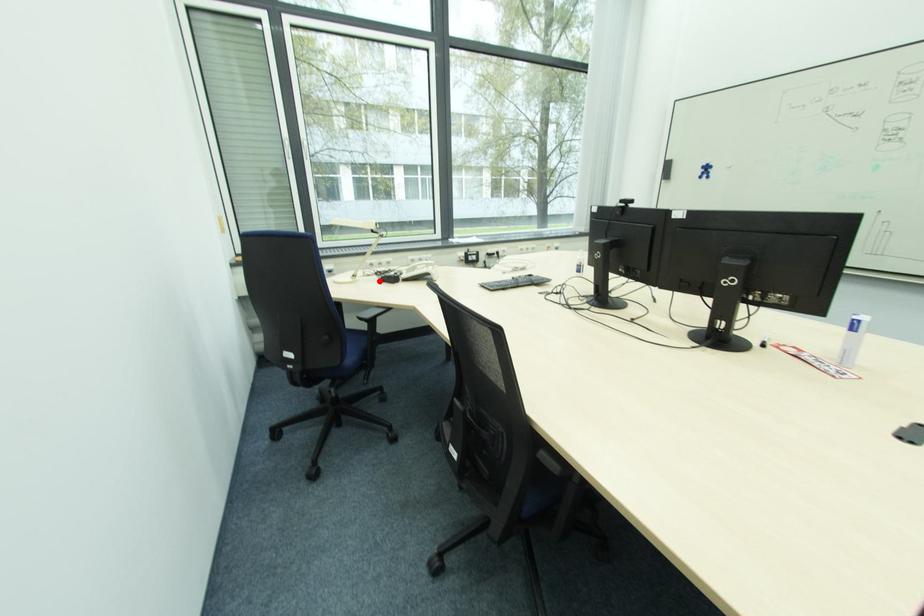
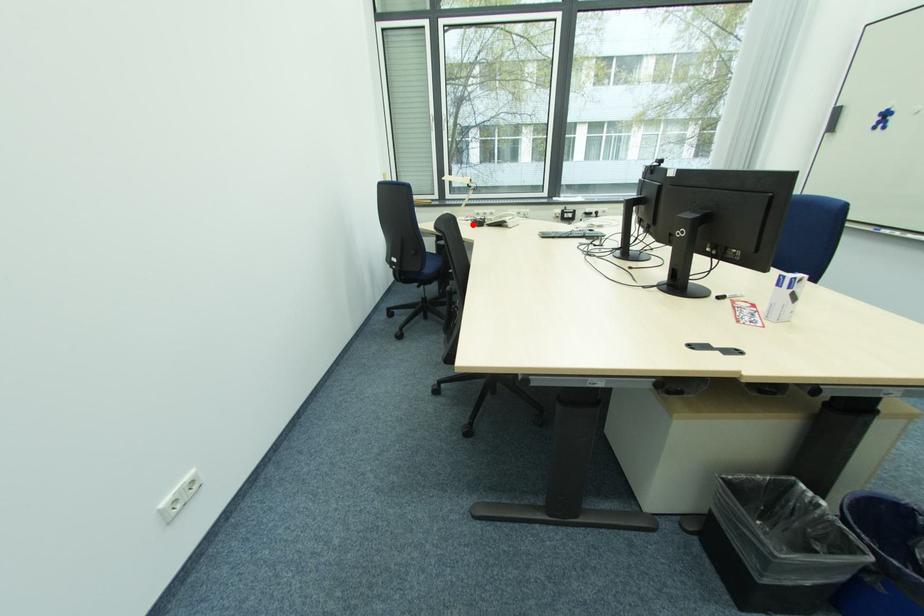
I am providing you with two images of the same scene from different viewpoints. A red point is marked on the first image and another point is marked on the second image. Does the point marked in image1 correspond to the same location as the one in image2?

Yes